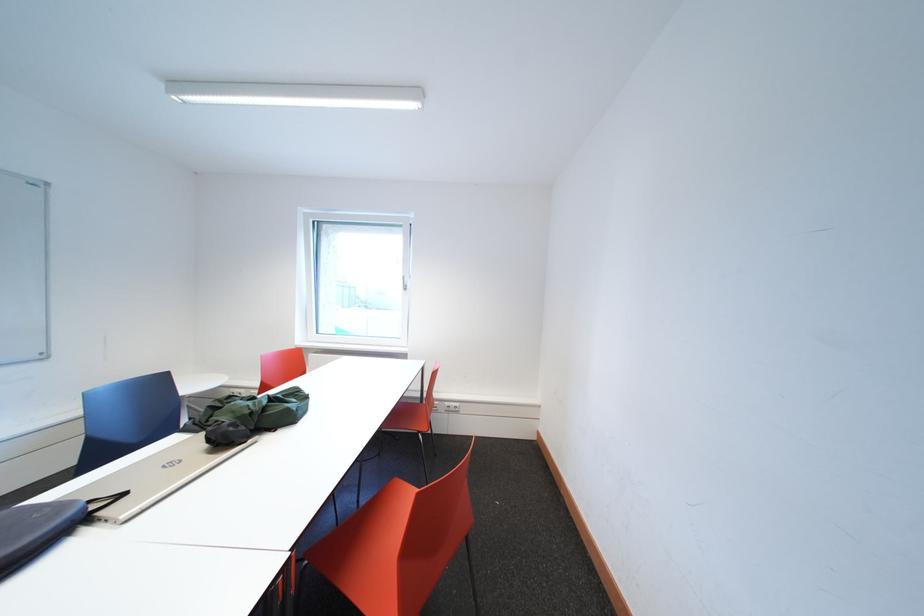
This screenshot has width=924, height=616. What do you see at coordinates (450, 407) in the screenshot? I see `the white power outlet` at bounding box center [450, 407].